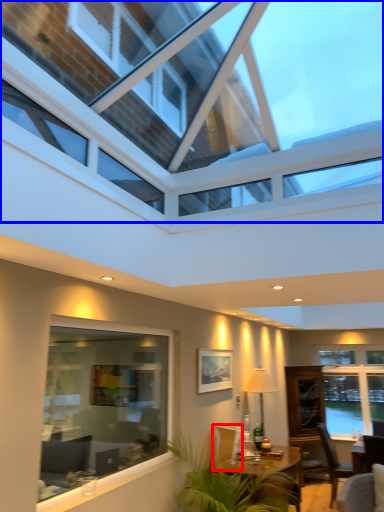
Question: Which of the following is the farthest to the observer, armchair (highlighted by a red box) or window (highlighted by a blue box)?

Choices:
 (A) armchair
 (B) window

Answer: (A)